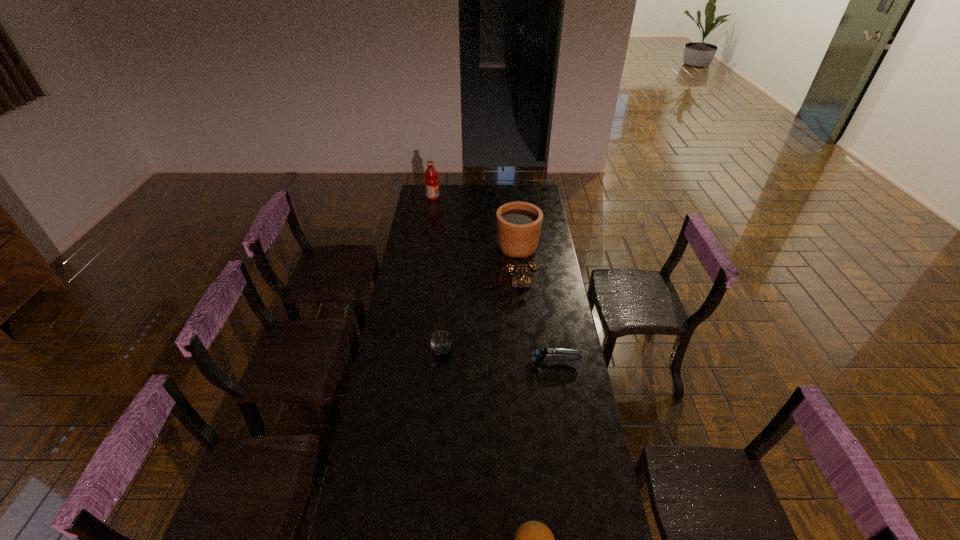
Find the location of a particular element. The image size is (960, 540). vacant point located on the front-facing side of the fourth nearest object is located at coordinates [511, 322].

Image resolution: width=960 pixels, height=540 pixels. Find the location of `vacant area located 0.390m at the front element of the third shortest object`. vacant area located 0.390m at the front element of the third shortest object is located at coordinates (543, 350).

Identify the location of free region located 0.200m on the head of the electric shaver. (482, 361).

Locate an element on the screen. The width and height of the screenshot is (960, 540). vacant region located on the head of the electric shaver is located at coordinates (511, 361).

At what (x,y) coordinates should I click in order to perform the action: click on vacant point located on the head of the electric shaver. Please return your answer as a coordinate pair (x, y). Looking at the image, I should click on (439, 361).

The height and width of the screenshot is (540, 960). What are the coordinates of `object present at the far edge` in the screenshot? It's located at (431, 182).

Identify the location of object at the left edge. This screenshot has width=960, height=540. (431, 182).

Identify the location of flowerpot that is at the right edge. (518, 223).

The width and height of the screenshot is (960, 540). Identify the location of telephone positioned at the right edge. (521, 280).

Where is `electric shaver that is positioned at the right edge`? The height and width of the screenshot is (540, 960). electric shaver that is positioned at the right edge is located at coordinates (540, 356).